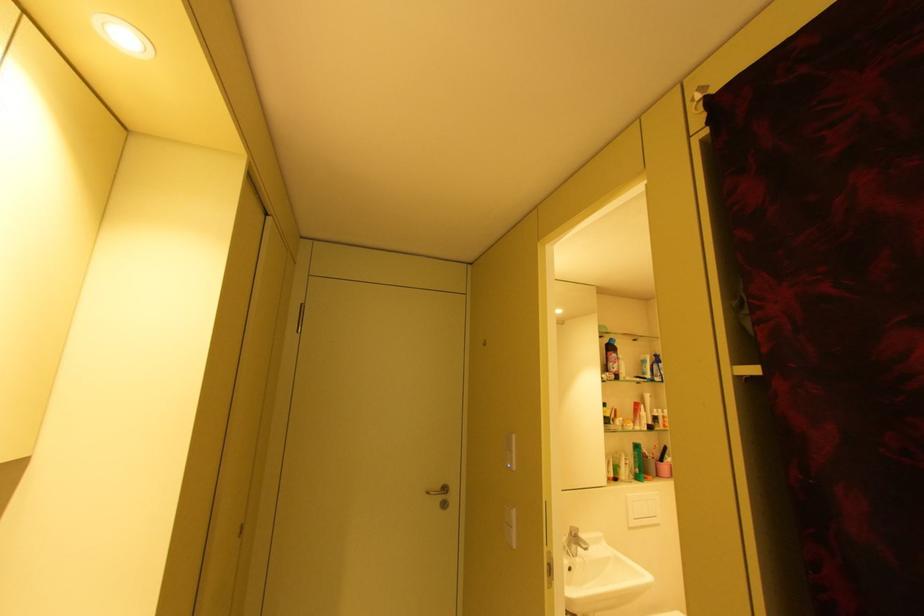
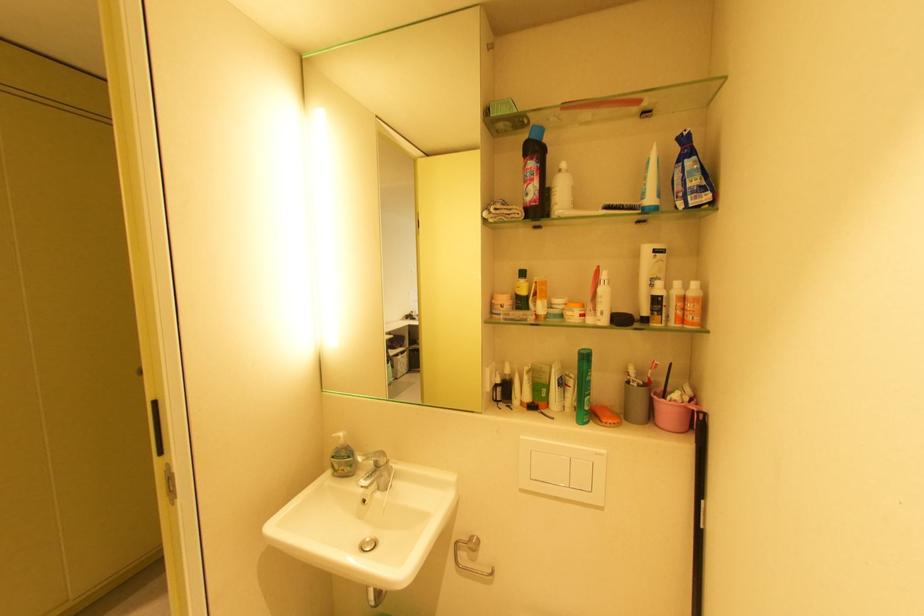
Locate, in the second image, the point that corresponds to point (628, 374) in the first image.

(563, 205)